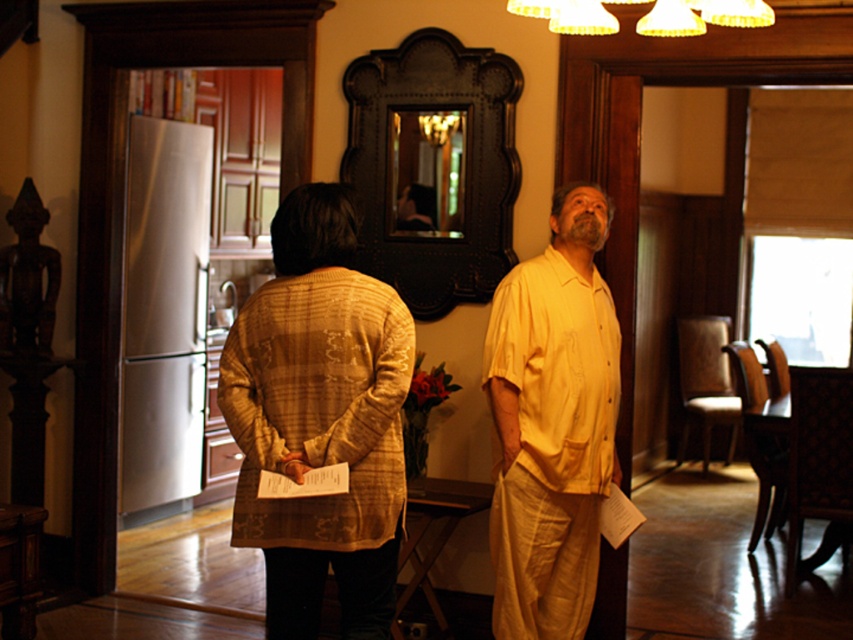
Question: Is matte yellow shirt at center positioned before matte yellow cardigan at center?

Choices:
 (A) no
 (B) yes

Answer: (B)

Question: Which point is farther from the camera taking this photo?

Choices:
 (A) (495, 298)
 (B) (343, 204)

Answer: (A)

Question: Is matte yellow cardigan at center closer to camera compared to yellow cotton shirt at center?

Choices:
 (A) yes
 (B) no

Answer: (A)

Question: Can you confirm if matte yellow shirt at center is positioned to the right of yellow cotton shirt at center?

Choices:
 (A) no
 (B) yes

Answer: (A)

Question: Which point is farther to the camera?

Choices:
 (A) (285, 540)
 (B) (540, 525)

Answer: (B)

Question: Which of the following is the closest to the observer?

Choices:
 (A) yellow cotton shirt at center
 (B) matte yellow shirt at center

Answer: (B)